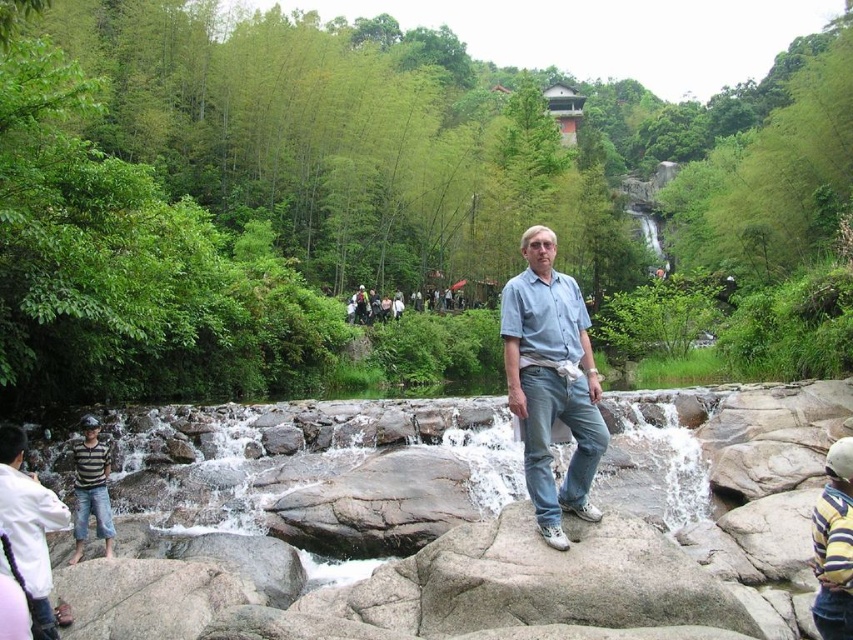
What are the coordinates of the light blue denim jeans at center?

The light blue denim jeans at center are located at coordinates point (x=550, y=381).

You are a photographer trying to capture the man in the scene. You notice the light blue denim jeans at center and the white shirt at lower left. Which clothing item is positioned higher in the image?

The light blue denim jeans at center is located above the white shirt at lower left, so the light blue denim jeans at center is positioned higher in the image.

You are a photographer trying to capture the man in the scene. You need to ensure that the light blue denim jeans at center and white shirt at lower left are both visible in the frame. Given their widths, which clothing item would require a wider angle to fully capture in the photo?

The light blue denim jeans at center would require a wider angle to fully capture in the photo since its width surpasses that of the white shirt at lower left.